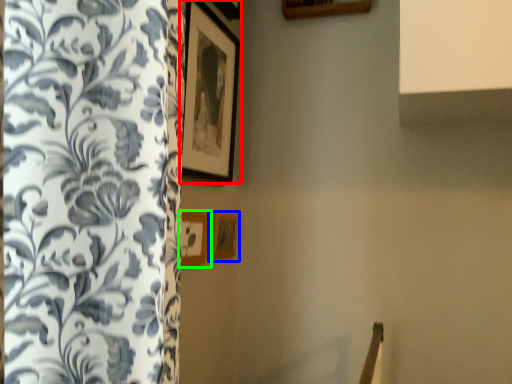
Question: Which is farther away from picture frame (highlighted by a red box)? picture frame (highlighted by a blue box) or picture frame (highlighted by a green box)?

Choices:
 (A) picture frame
 (B) picture frame

Answer: (A)